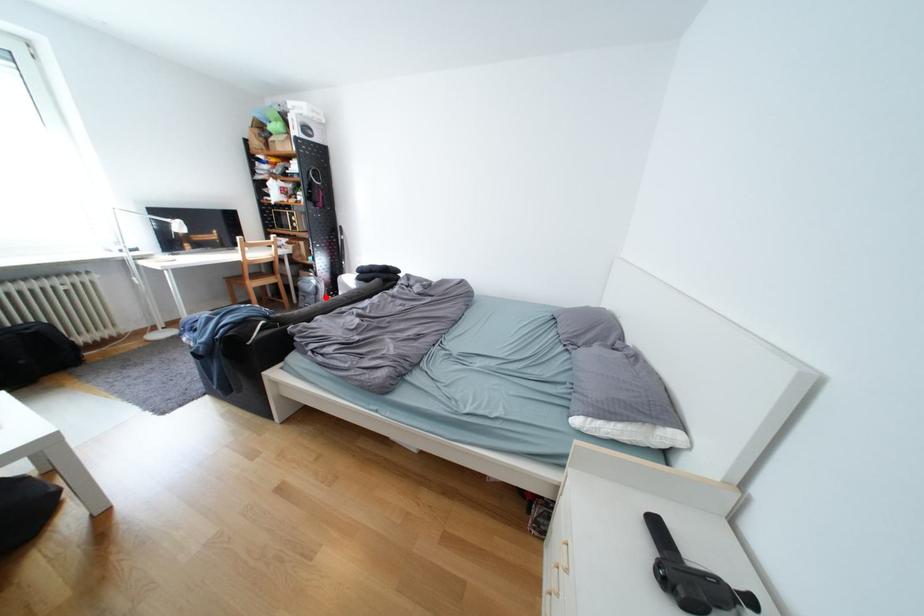
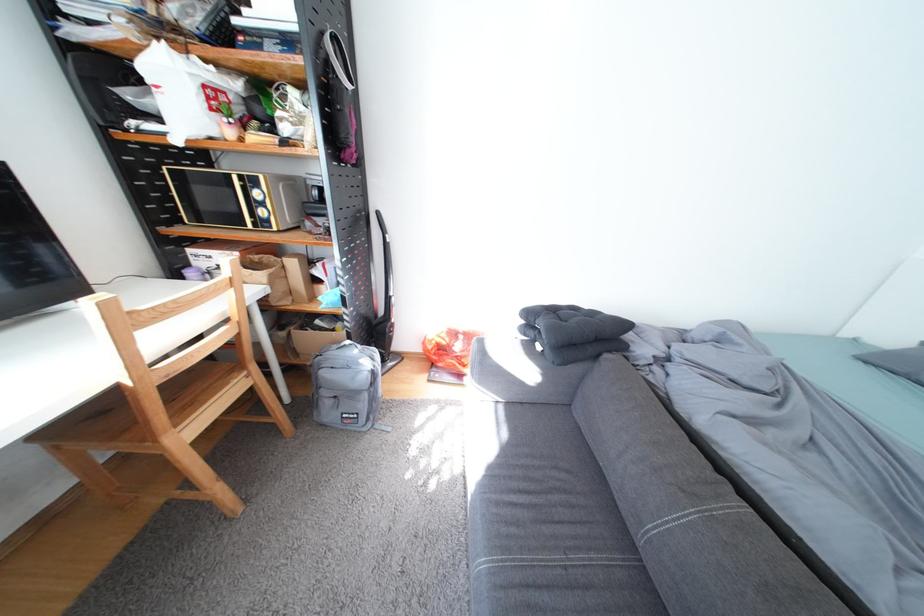
Question: I am providing you with two images of the same scene from different viewpoints. Image1 has a red point marked. In image2, the corresponding 3D location appears at what relative position? Reply with the corresponding letter.

Choices:
 (A) Closer
 (B) Farther

Answer: (A)